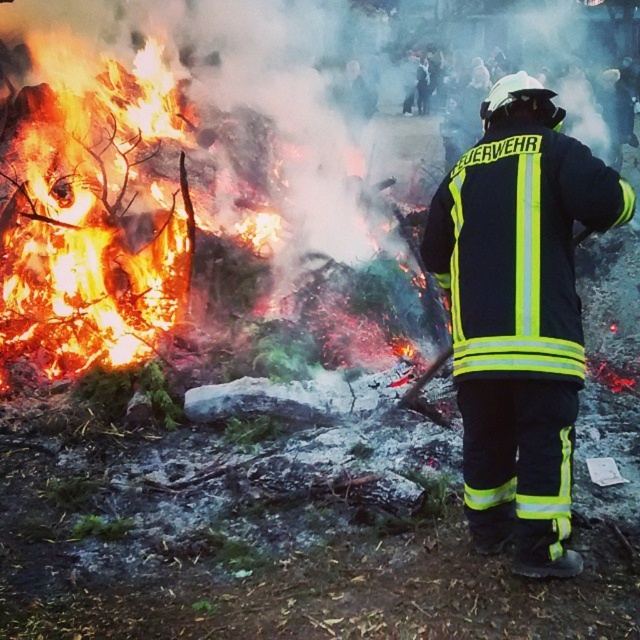
Question: Can you confirm if flaming wood at left is thinner than reflective yellow-green uniform at center?

Choices:
 (A) yes
 (B) no

Answer: (B)

Question: Is flaming wood at left above reflective yellow-green uniform at center?

Choices:
 (A) yes
 (B) no

Answer: (B)

Question: Can you confirm if flaming wood at left is wider than reflective yellow-green uniform at center?

Choices:
 (A) yes
 (B) no

Answer: (A)

Question: Which point is closer to the camera?

Choices:
 (A) (273, 125)
 (B) (556, 269)

Answer: (B)